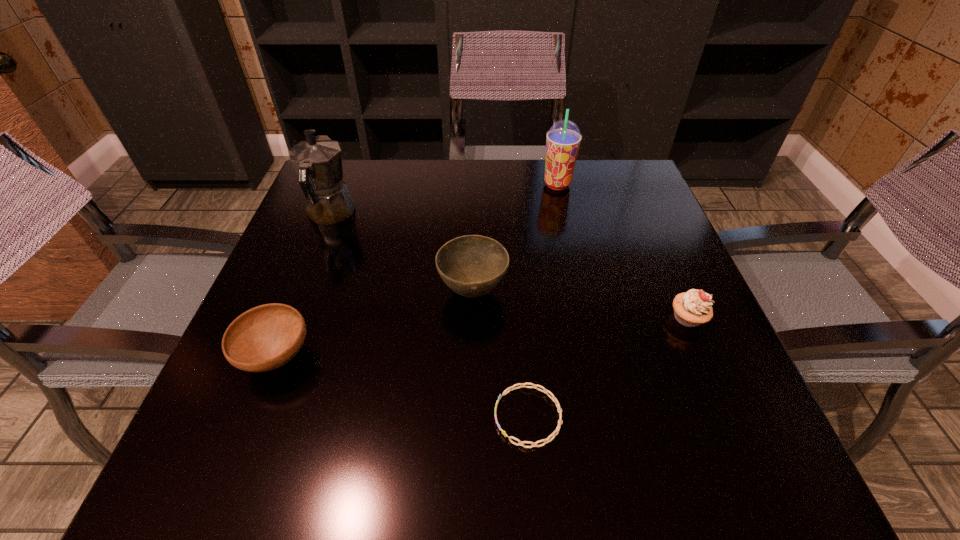
At what (x,y) coordinates should I click in order to perform the action: click on free point located on the front of the smoothie. Please return your answer as a coordinate pair (x, y). Looking at the image, I should click on (575, 267).

This screenshot has width=960, height=540. In order to click on vacant space located on the right of the taller bowl in this screenshot , I will do `click(656, 292)`.

Identify the location of vacant position located on the back of the rightmost object. Image resolution: width=960 pixels, height=540 pixels. (642, 212).

Where is `vacant space located 0.390m on the right of the fifth tallest object`? Image resolution: width=960 pixels, height=540 pixels. vacant space located 0.390m on the right of the fifth tallest object is located at coordinates (527, 356).

Find the location of a particular element. Image resolution: width=960 pixels, height=540 pixels. blank space located 0.330m on the surface of the shortest object showing star-shaped elements is located at coordinates (293, 416).

Locate an element on the screen. The height and width of the screenshot is (540, 960). free space located 0.050m on the surface of the shortest object showing star-shaped elements is located at coordinates (464, 416).

You are a GUI agent. You are given a task and a screenshot of the screen. Output one action in this format:
    pyautogui.click(x=<x>, y=<y>)
    Task: Click on the vacant space situated 0.280m on the surface of the shortest object showing star-shaped elements
    
    Given the screenshot: What is the action you would take?
    pyautogui.click(x=324, y=416)

This screenshot has width=960, height=540. Identify the location of coffeepot that is at the far edge. (317, 161).

At what (x,y) coordinates should I click in order to perform the action: click on smoothie positioned at the far edge. Please return your answer as a coordinate pair (x, y). Looking at the image, I should click on (563, 139).

Image resolution: width=960 pixels, height=540 pixels. In order to click on object at the near edge in this screenshot , I will do `click(511, 388)`.